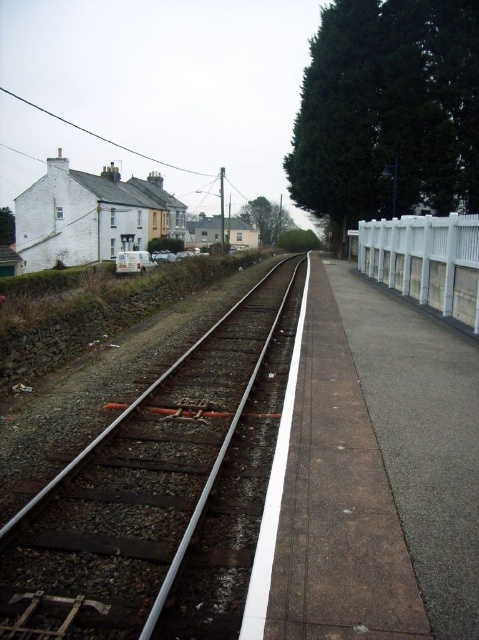
Who is more forward, (x=240, y=340) or (x=428, y=301)?

Point (x=240, y=340)

Find the location of a particular element. The image size is (479, 640). rusty metal train track at center is located at coordinates (161, 493).